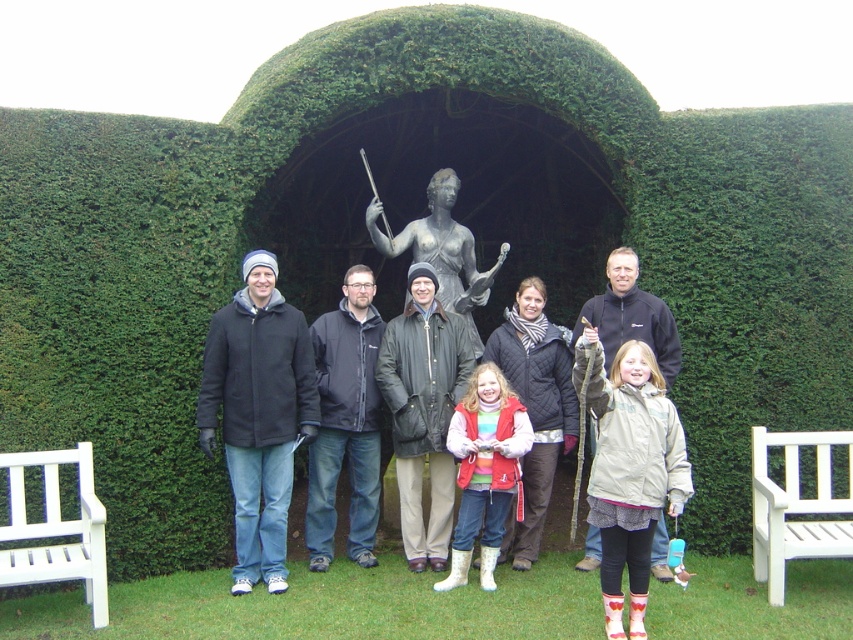
You are a photographer trying to capture the black jacket at center and the white wooden bench at lower right in the same frame. Based on their positions, can you determine if the bench is visible behind the jacket?

The black jacket at center is positioned over the white wooden bench at lower right, so the bench is partially or fully obscured by the jacket and may not be visible in the photo.

You are standing in front of the large arched structure covered with dense green foliage. You see a point at coordinates (422, 412). What object is located at that point?

The point at (422, 412) corresponds to the dark brown leather jacket at center.